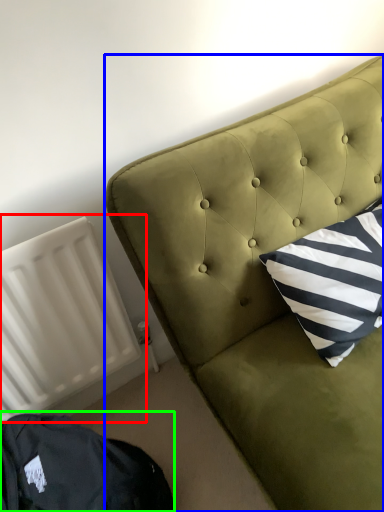
Question: Considering the real-world distances, which object is closest to radiator (highlighted by a red box)? furniture (highlighted by a blue box) or bean bag chair (highlighted by a green box).

Choices:
 (A) furniture
 (B) bean bag chair

Answer: (B)